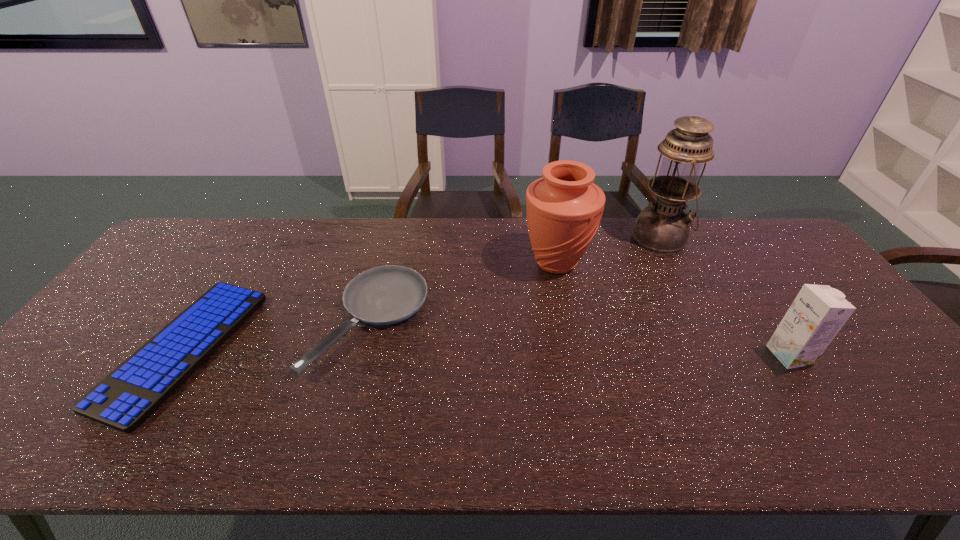
You are a GUI agent. You are given a task and a screenshot of the screen. Output one action in this format:
    pyautogui.click(x=<x>, y=<y>)
    Task: Click on the tallest object
    
    Given the screenshot: What is the action you would take?
    pyautogui.click(x=663, y=227)

What are the coordinates of `the second object from right to left` in the screenshot? It's located at (663, 227).

This screenshot has width=960, height=540. Find the location of `the third object from left to right`. the third object from left to right is located at coordinates (564, 208).

Image resolution: width=960 pixels, height=540 pixels. What are the coordinates of `the second tallest object` in the screenshot? It's located at (564, 208).

I want to click on the rightmost object, so click(x=817, y=314).

Image resolution: width=960 pixels, height=540 pixels. Find the location of `carton`. carton is located at coordinates (817, 314).

This screenshot has width=960, height=540. I want to click on the fourth tallest object, so click(384, 295).

Locate an element on the screen. The width and height of the screenshot is (960, 540). the fourth object from right to left is located at coordinates (384, 295).

Identify the location of the leftmost object. (130, 394).

Where is `the shortest object`? This screenshot has width=960, height=540. the shortest object is located at coordinates (130, 394).